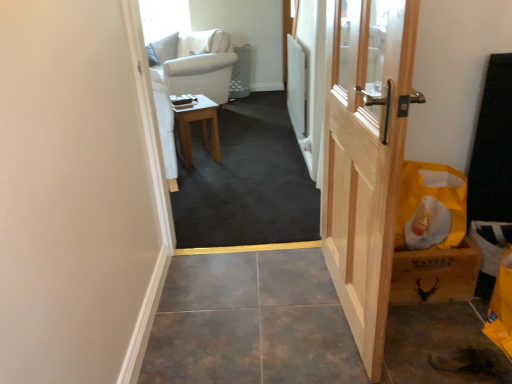
Question: From a real-world perspective, is yellow paper bag at right on carpeted floor at center?

Choices:
 (A) no
 (B) yes

Answer: (B)

Question: From the image's perspective, is yellow paper bag at right beneath carpeted floor at center?

Choices:
 (A) no
 (B) yes

Answer: (B)

Question: Is yellow paper bag at right not close to carpeted floor at center?

Choices:
 (A) yes
 (B) no

Answer: (B)

Question: Is yellow paper bag at right shorter than carpeted floor at center?

Choices:
 (A) no
 (B) yes

Answer: (A)

Question: From the image's perspective, is yellow paper bag at right over carpeted floor at center?

Choices:
 (A) yes
 (B) no

Answer: (B)

Question: Is yellow paper bag at right in front of or behind wooden table at center in the image?

Choices:
 (A) front
 (B) behind

Answer: (A)

Question: Considering the positions of yellow paper bag at right and wooden table at center in the image, is yellow paper bag at right bigger or smaller than wooden table at center?

Choices:
 (A) big
 (B) small

Answer: (B)

Question: From the image's perspective, is yellow paper bag at right located above or below wooden table at center?

Choices:
 (A) above
 (B) below

Answer: (B)

Question: Is yellow paper bag at right spatially inside wooden table at center, or outside of it?

Choices:
 (A) inside
 (B) outside

Answer: (B)

Question: In terms of width, does natural wood door at right look wider or thinner when compared to carpeted floor at center?

Choices:
 (A) thin
 (B) wide

Answer: (A)

Question: From a real-world perspective, is natural wood door at right positioned above or below carpeted floor at center?

Choices:
 (A) above
 (B) below

Answer: (A)

Question: In the image, is natural wood door at right on the left side or the right side of carpeted floor at center?

Choices:
 (A) left
 (B) right

Answer: (B)

Question: Would you say natural wood door at right is inside or outside carpeted floor at center?

Choices:
 (A) inside
 (B) outside

Answer: (B)

Question: Would you say natural wood door at right is to the left or to the right of yellow paper bag at right in the picture?

Choices:
 (A) left
 (B) right

Answer: (A)

Question: Is natural wood door at right taller or shorter than yellow paper bag at right?

Choices:
 (A) tall
 (B) short

Answer: (A)